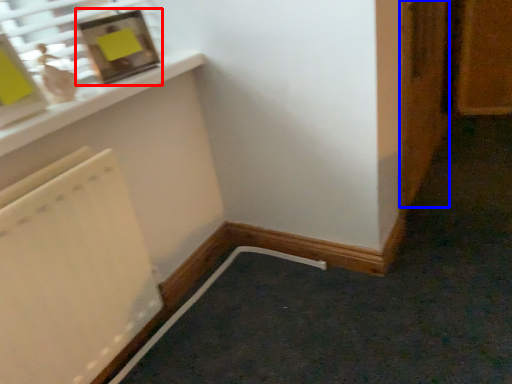
Question: Which point is further to the camera, picture frame (highlighted by a red box) or door (highlighted by a blue box)?

Choices:
 (A) picture frame
 (B) door

Answer: (B)